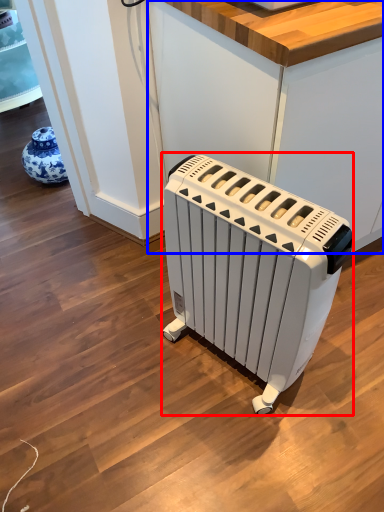
Question: Which point is further to the camera, home appliance (highlighted by a red box) or counter (highlighted by a blue box)?

Choices:
 (A) home appliance
 (B) counter

Answer: (B)